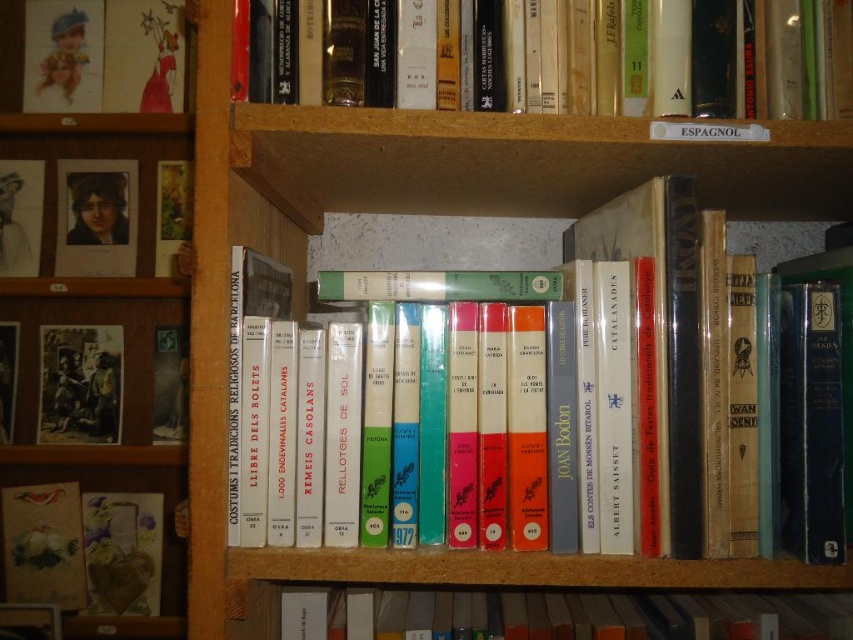
Consider the image. Does hardcover book at upper center have a lesser width compared to hardcover books at center?

Indeed, hardcover book at upper center has a lesser width compared to hardcover books at center.

Does point (849, 72) come farther from viewer compared to point (849, 250)?

That is False.

Between point (773, 38) and point (375, 232), which one is positioned behind?

The point (375, 232) is behind.

In order to click on hardcover book at upper center in this screenshot , I will do `click(665, 58)`.

Looking at this image, is wooden bookshelf at center behind matte black photograph at left?

No, wooden bookshelf at center is in front of matte black photograph at left.

Can you confirm if wooden bookshelf at center is thinner than matte black photograph at left?

No.

Which is in front, point (9, 97) or point (65, 438)?

Point (65, 438) is more forward.

Identify the location of wooden bookshelf at center. (103, 323).

Is hardcover book at center shorter than matte cardboard book at lower left?

Yes, hardcover book at center is shorter than matte cardboard book at lower left.

Is hardcover book at center further to camera compared to matte cardboard book at lower left?

No, it is in front of matte cardboard book at lower left.

Which is behind, point (642, 608) or point (24, 508)?

Positioned behind is point (24, 508).

Where is `hardcover book at center`? hardcover book at center is located at coordinates (561, 616).